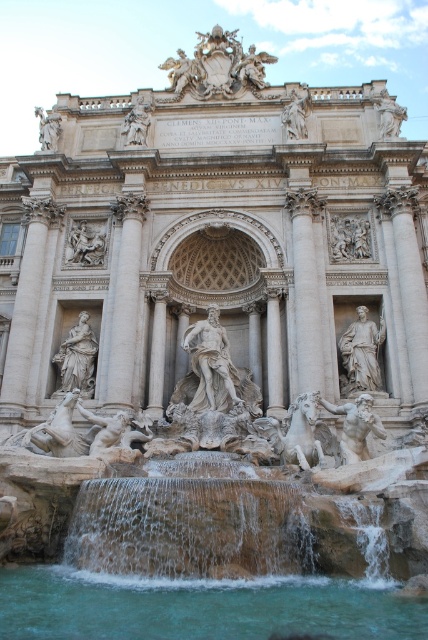
Who is positioned more to the right, golden stone sculpture at upper center or white marble statue at upper center?

white marble statue at upper center

Does golden stone sculpture at upper center appear on the right side of white marble statue at upper center?

No, golden stone sculpture at upper center is not to the right of white marble statue at upper center.

Does point (193, 61) lie behind point (296, 125)?

Yes.

The image size is (428, 640). I want to click on golden stone sculpture at upper center, so click(217, 67).

Who is more forward, (256,65) or (294,132)?

Point (294,132)

Between point (244, 74) and point (303, 90), which one is positioned in front?

Positioned in front is point (303, 90).

Where is `polished marble statue at upper center`? This screenshot has width=428, height=640. polished marble statue at upper center is located at coordinates (252, 68).

Which of these two, smooth stone waterfall at lower center or polished bronze statue at upper center, stands taller?

polished bronze statue at upper center

Does smooth stone waterfall at lower center have a greater height compared to polished bronze statue at upper center?

In fact, smooth stone waterfall at lower center may be shorter than polished bronze statue at upper center.

Who is more distant from viewer, (232, 540) or (171, 74)?

Positioned behind is point (171, 74).

Image resolution: width=428 pixels, height=640 pixels. In order to click on smooth stone waterfall at lower center in this screenshot , I will do (189, 528).